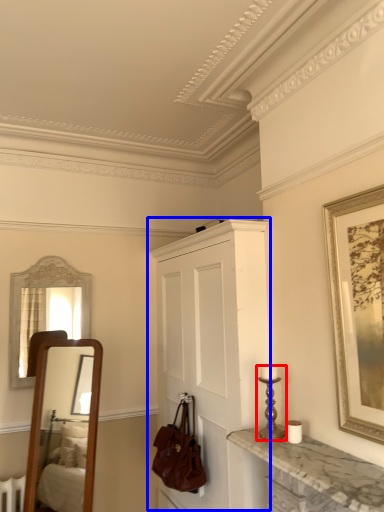
Question: Among these objects, which one is farthest to the camera, candle holder (highlighted by a red box) or cabinetry (highlighted by a blue box)?

Choices:
 (A) candle holder
 (B) cabinetry

Answer: (B)